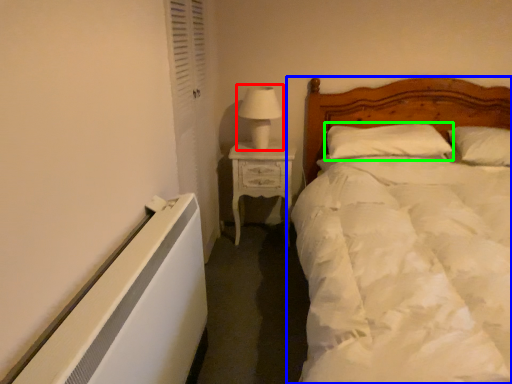
Question: Based on their relative distances, which object is nearer to table lamp (highlighted by a red box)? Choose from bed (highlighted by a blue box) and pillow (highlighted by a green box).

Choices:
 (A) bed
 (B) pillow

Answer: (B)